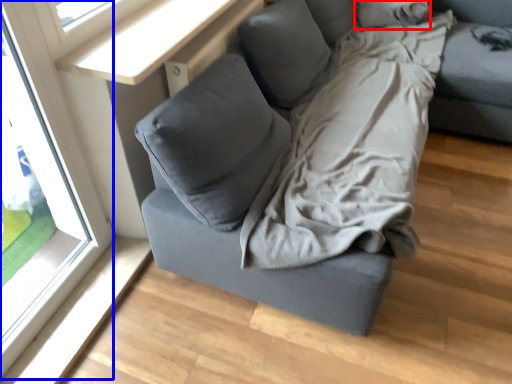
Question: Which of the following is the farthest to the observer, pillow (highlighted by a red box) or window (highlighted by a blue box)?

Choices:
 (A) pillow
 (B) window

Answer: (A)